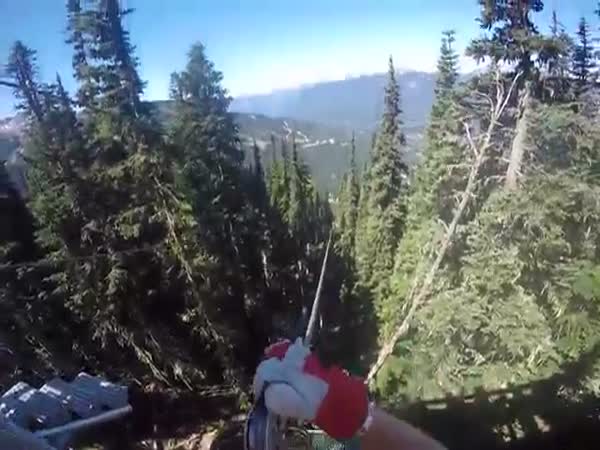
I want to click on metal frame, so [43, 412], [76, 394], [110, 386].